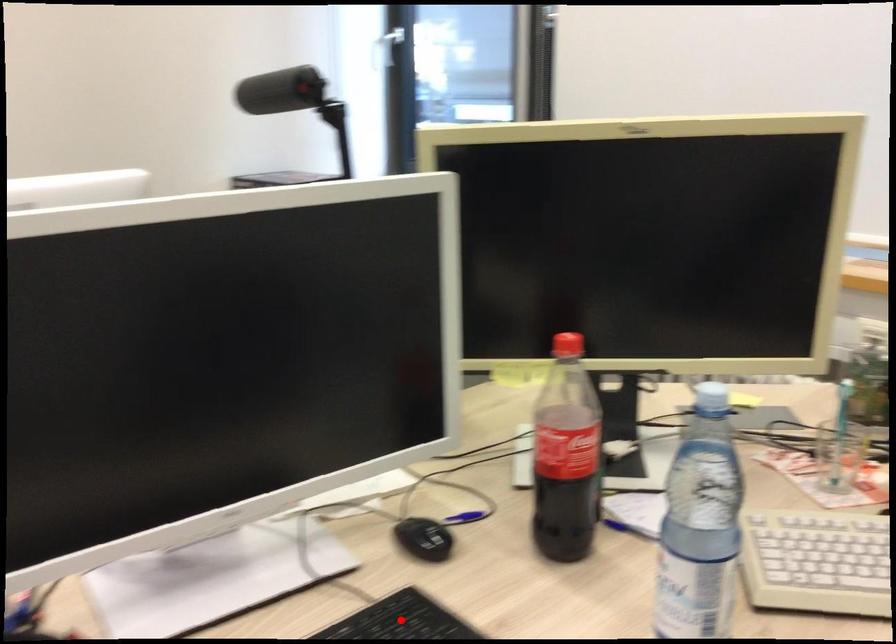
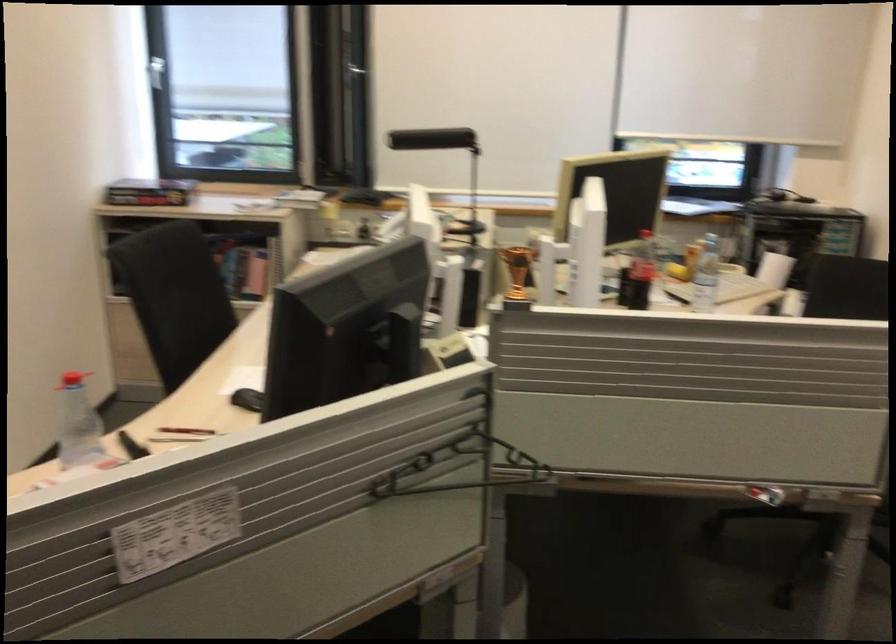
Question: I am providing you with two images of the same scene from different viewpoints. A red point is marked on the first image. Can you still see the location of the red point in image 2?

Choices:
 (A) Yes
 (B) No

Answer: (B)